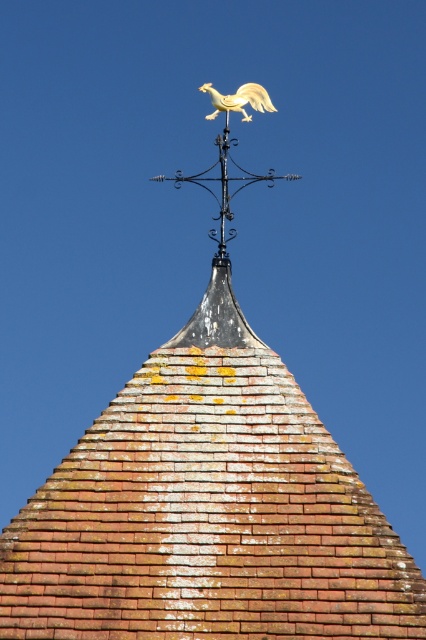
Can you confirm if gold matte rooster at upper center is positioned below gold polished rooster at upper center?

Yes.

Looking at this image, can you confirm if gold matte rooster at upper center is thinner than gold polished rooster at upper center?

In fact, gold matte rooster at upper center might be wider than gold polished rooster at upper center.

The height and width of the screenshot is (640, 426). What do you see at coordinates (224, 186) in the screenshot? I see `gold matte rooster at upper center` at bounding box center [224, 186].

Where is `gold matte rooster at upper center`? gold matte rooster at upper center is located at coordinates (224, 186).